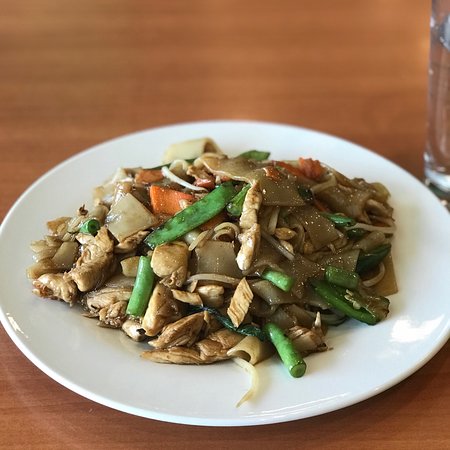
Identify the location of glass. The height and width of the screenshot is (450, 450). (438, 101).